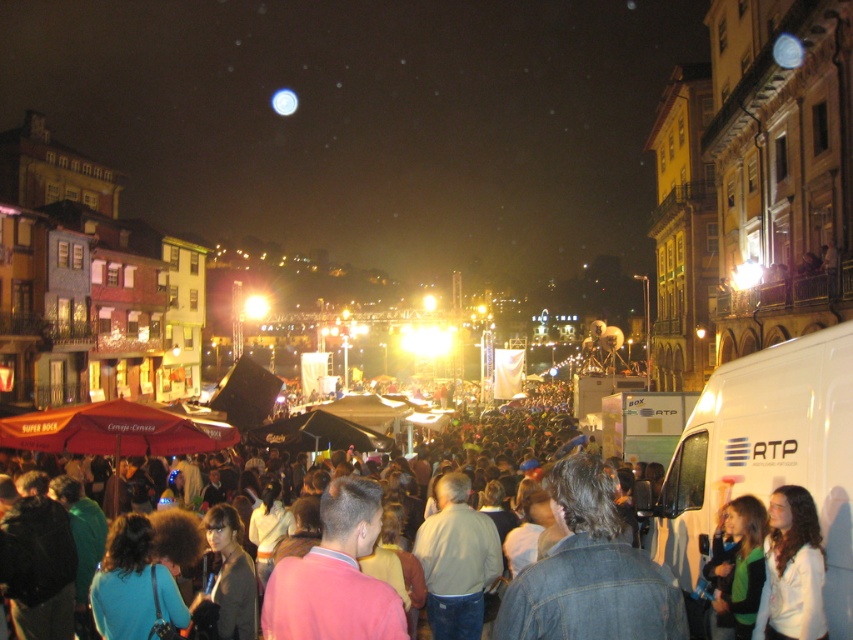
Question: Is white matte van at lower right to the right of denim jacket at center from the viewer's perspective?

Choices:
 (A) yes
 (B) no

Answer: (A)

Question: Which point is farther to the camera?

Choices:
 (A) green fleece jacket at lower right
 (B) denim jacket at lower right
 (C) denim jacket at center

Answer: (A)

Question: Can you confirm if white matte van at lower right is positioned to the right of denim jacket at center?

Choices:
 (A) yes
 (B) no

Answer: (A)

Question: Which of the following is the farthest from the observer?

Choices:
 (A) (740, 563)
 (B) (798, 628)

Answer: (A)

Question: Which of these objects is positioned farthest from the white matte jacket at lower right?

Choices:
 (A) green fleece jacket at lower right
 (B) white matte van at lower right
 (C) denim jacket at lower right
 (D) denim jacket at center

Answer: (D)

Question: Observing the image, what is the correct spatial positioning of white matte van at lower right in reference to denim jacket at center?

Choices:
 (A) below
 (B) above

Answer: (B)